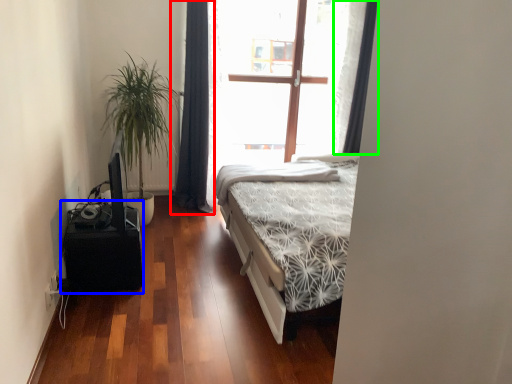
Question: Based on their relative distances, which object is farther from curtain (highlighted by a red box)? Choose from table (highlighted by a blue box) and curtain (highlighted by a green box).

Choices:
 (A) table
 (B) curtain

Answer: (A)